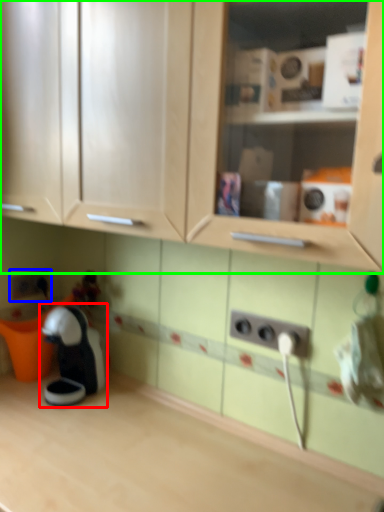
Question: Which object is the farthest from toy (highlighted by a red box)? Choose among these: electric outlet (highlighted by a blue box) or cabinetry (highlighted by a green box).

Choices:
 (A) electric outlet
 (B) cabinetry

Answer: (B)